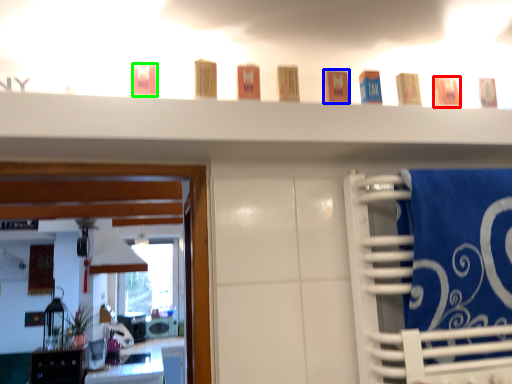
Question: Which is nearer to the toiletry (highlighted by a red box)? toiletry (highlighted by a blue box) or toiletry (highlighted by a green box).

Choices:
 (A) toiletry
 (B) toiletry

Answer: (A)